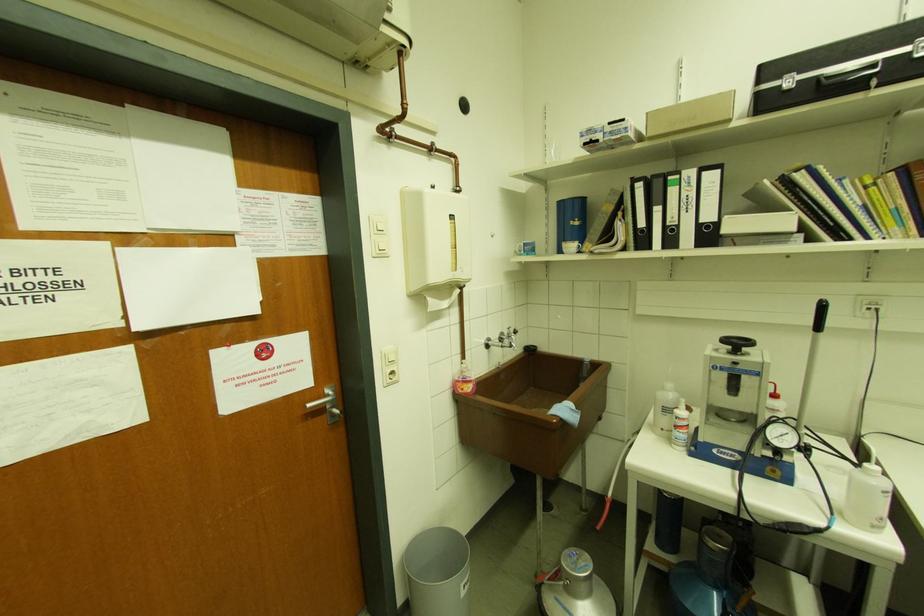
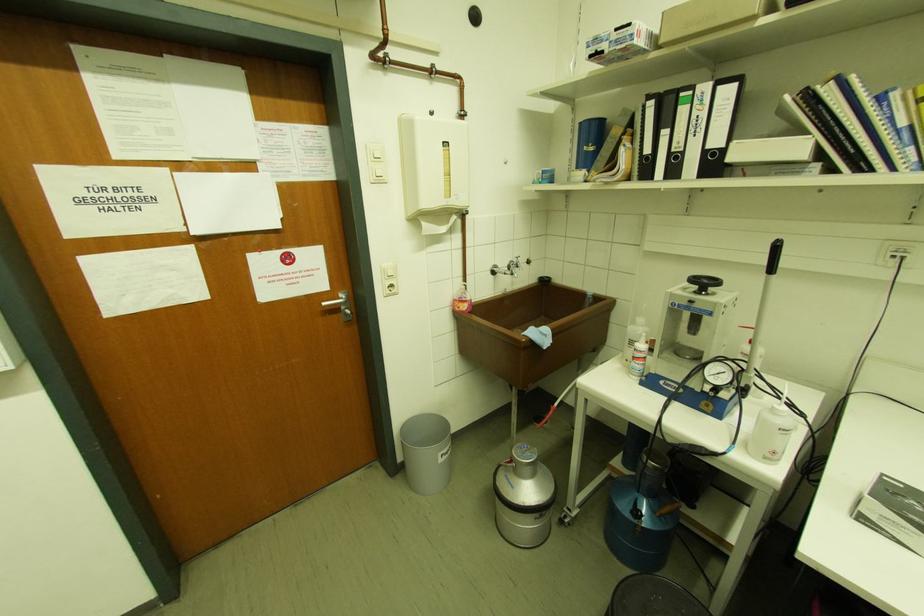
Locate, in the second image, the point that corresponds to the point at 665,431 in the first image.

(629, 362)